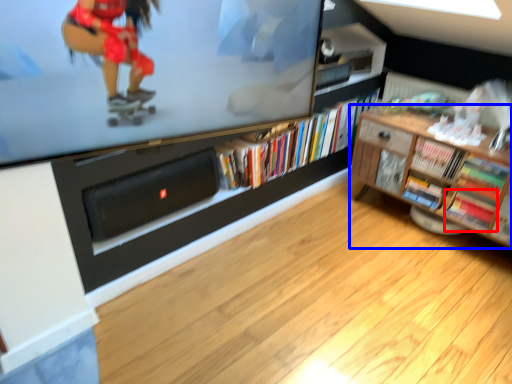
Question: Which of the following is the closest to the observer, book (highlighted by a red box) or shelf (highlighted by a blue box)?

Choices:
 (A) book
 (B) shelf

Answer: (B)